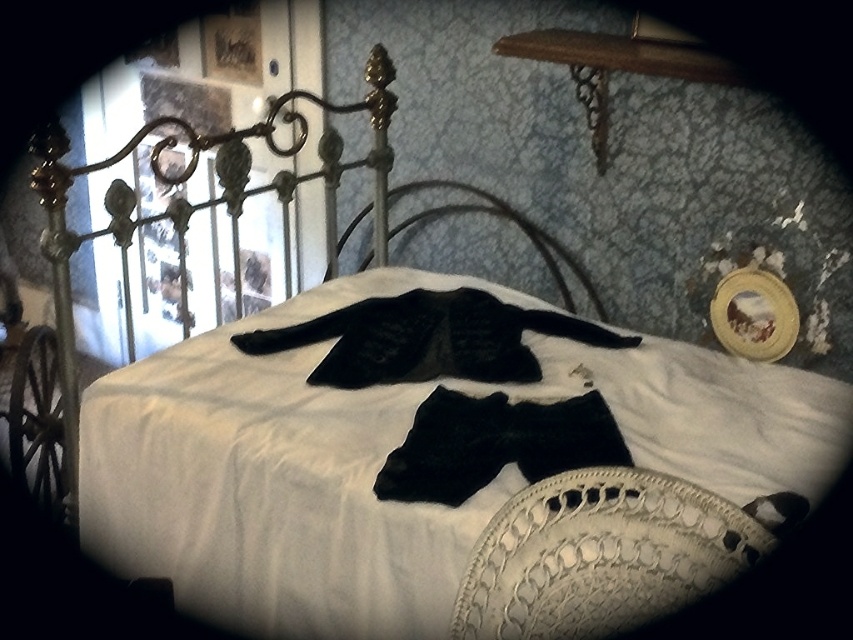
You are an interior designer assessing the vintage bedroom scene. You notice the white lace pillow at lower right and the black velvet bow tie at center. Which object has a greater height in the image?

The white lace pillow at lower right is taller than the black velvet bow tie at center according to the description.

You are organizing a formal event and need to place a black velvet bow tie at center on a table. The event space has a black matte iron bed at center as part of the decor. According to the image, where should you position the bow tie relative to the bed?

The black velvet bow tie at center should be placed to the right of the black matte iron bed at center, as shown in the image.

You are organizing a fashion show and need to arrange the white lace pillow at lower right and the black velvet bow tie at center for a photoshoot. According to the scene, which item is located to the right of the other?

The white lace pillow at lower right is positioned on the right side of the black velvet bow tie at center.